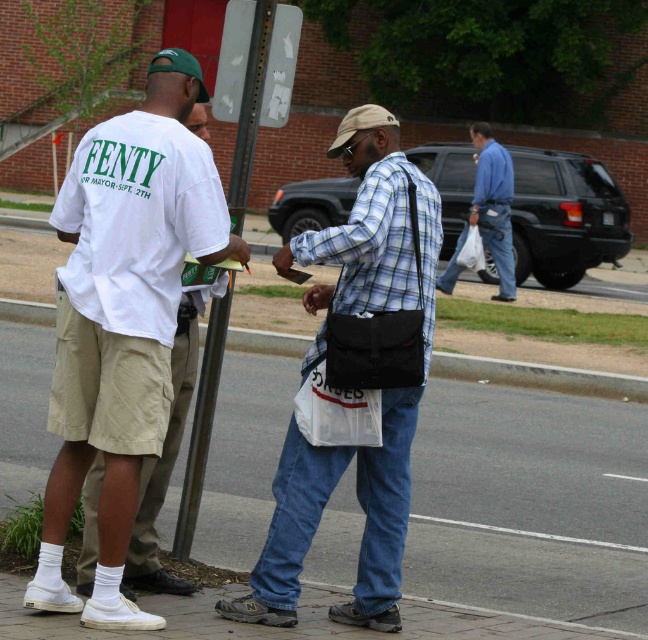
You are a pedestrian trying to cross the street. You see the smooth asphalt sidewalk at center and the blue cotton shirt at center. Which object is closer to you?

The smooth asphalt sidewalk at center is closer to you because it is in front of the blue cotton shirt at center.